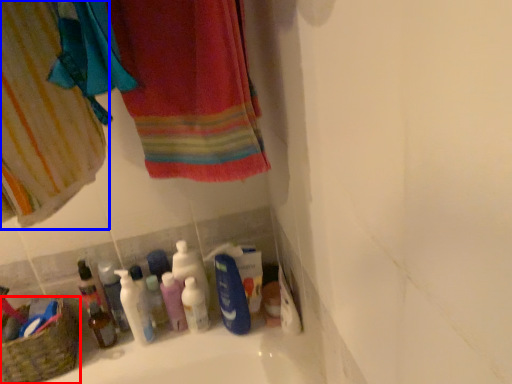
Question: Which object appears farthest to the camera in this image, basket (highlighted by a red box) or curtain (highlighted by a blue box)?

Choices:
 (A) basket
 (B) curtain

Answer: (A)